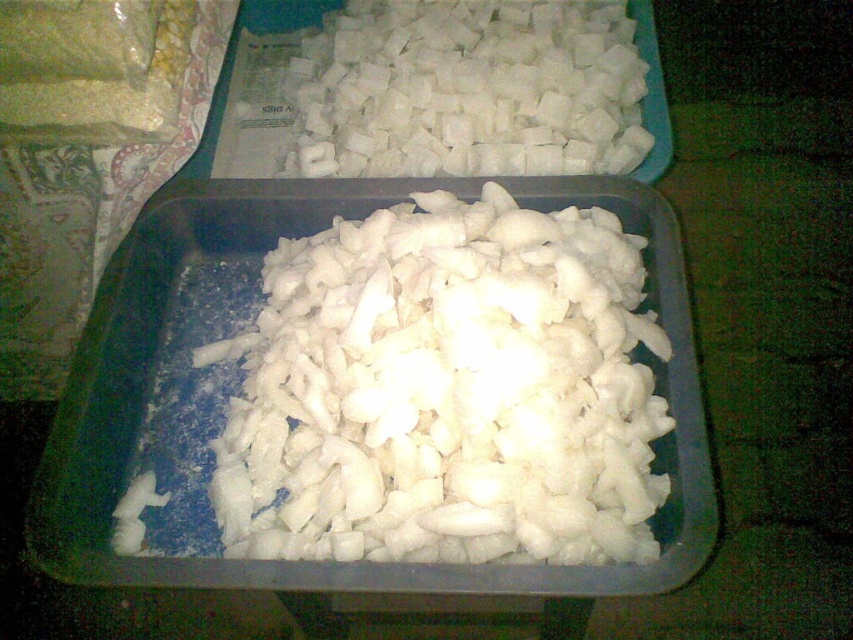
You are preparing a recipe that requires equal volumes of white matte chopped onions at center and white sugar cubes at upper center. Given their sizes, which one do you need more of to have the same volume?

The white matte chopped onions at center is bigger than the white sugar cubes at upper center, so you need fewer of them to achieve the same volume compared to the sugar cubes.

From the picture: You are organizing items on a table and need to place the white matte chopped onions at center between two containers. Based on their positions, which container is closer to the onions?

The white matte chopped onions at center is located at point (445, 390). Since the foreground container is closer to the viewer, it is closer to the onions compared to the background container, which is farther away.